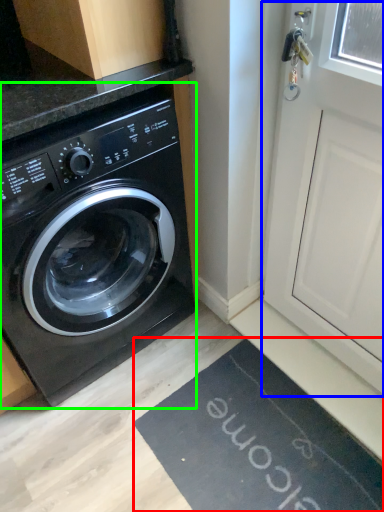
Question: Which is nearer to the bath mat (highlighted by a red box)? screen door (highlighted by a blue box) or washing machine (highlighted by a green box).

Choices:
 (A) screen door
 (B) washing machine

Answer: (A)